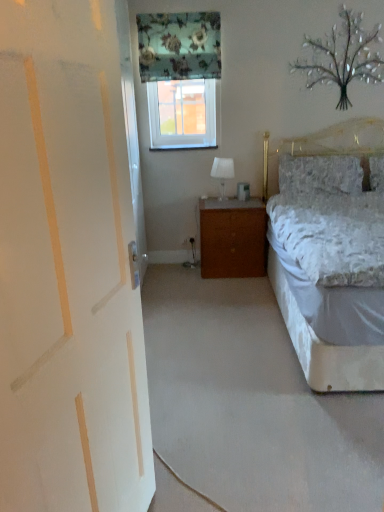
Question: In terms of width, does white glossy table lamp at center look wider or thinner when compared to clear glass window at upper center?

Choices:
 (A) wide
 (B) thin

Answer: (A)

Question: Is white glossy table lamp at center in front of or behind clear glass window at upper center in the image?

Choices:
 (A) front
 (B) behind

Answer: (A)

Question: Which of these objects is positioned closest to the fluffy white pillow at right?

Choices:
 (A) floral fabric curtain at upper center
 (B) white painted wood door at left
 (C) brown wood nightstand at center
 (D) white glossy table lamp at center
 (E) metallic silver tree at upper right

Answer: (C)

Question: Based on their relative distances, which object is nearer to the fluffy white pillow at right?

Choices:
 (A) clear glass window at upper center
 (B) white painted wood door at left
 (C) floral fabric curtain at upper center
 (D) metallic silver tree at upper right
 (E) brown wood nightstand at center

Answer: (E)